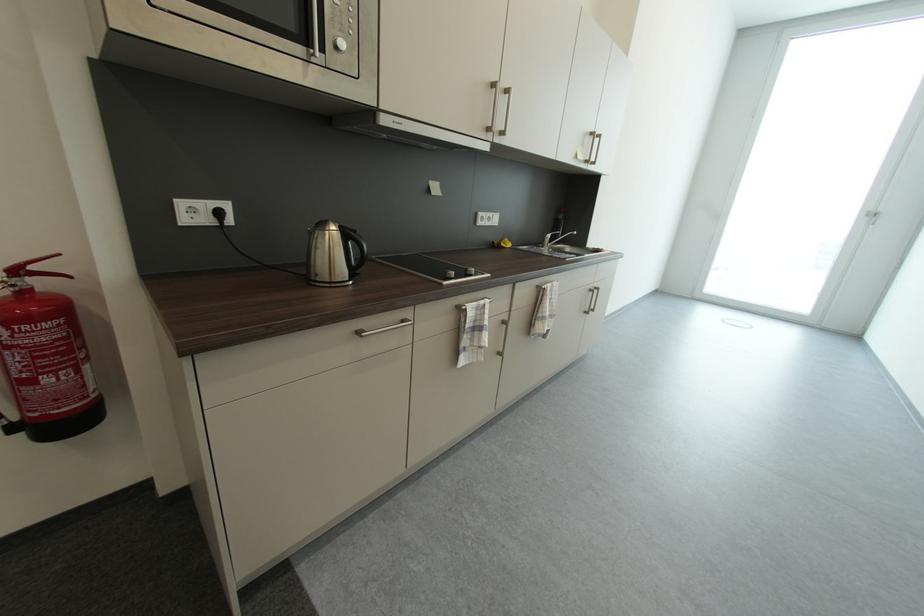
This screenshot has width=924, height=616. Describe the element at coordinates (457, 274) in the screenshot. I see `the cooktop control` at that location.